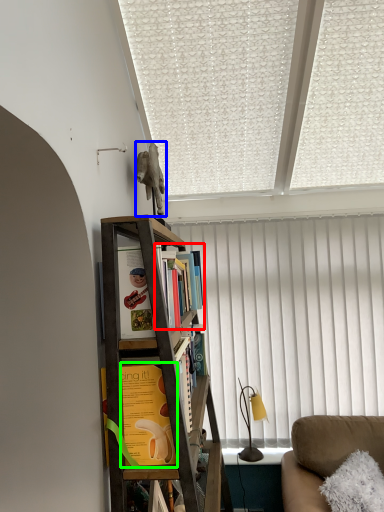
Question: Based on their relative distances, which object is farther from book (highlighted by a red box)? Choose from animal (highlighted by a blue box) and book (highlighted by a green box).

Choices:
 (A) animal
 (B) book

Answer: (B)